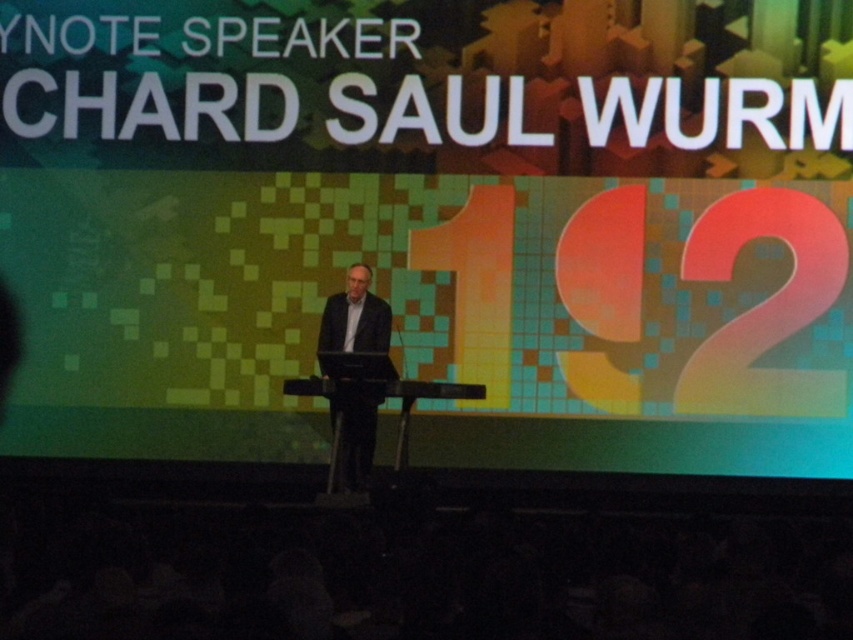
Question: Among these points, which one is nearest to the camera?

Choices:
 (A) (372, 429)
 (B) (412, 403)

Answer: (B)

Question: Is dark suit at center to the left of black plastic podium at center from the viewer's perspective?

Choices:
 (A) yes
 (B) no

Answer: (A)

Question: Can you confirm if dark suit at center is wider than black plastic podium at center?

Choices:
 (A) yes
 (B) no

Answer: (B)

Question: Which point is closer to the camera taking this photo?

Choices:
 (A) (369, 378)
 (B) (366, 312)

Answer: (A)

Question: Is dark suit at center closer to camera compared to black plastic podium at center?

Choices:
 (A) no
 (B) yes

Answer: (A)